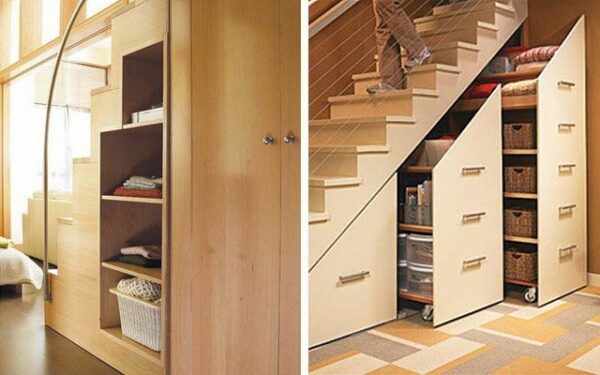
At what (x,y) coordinates should I click in order to perform the action: click on handle. Please return your answer as a coordinate pair (x, y). Looking at the image, I should click on (476, 260), (477, 212), (469, 167), (356, 279), (568, 245), (568, 205), (567, 166), (568, 121), (565, 82).